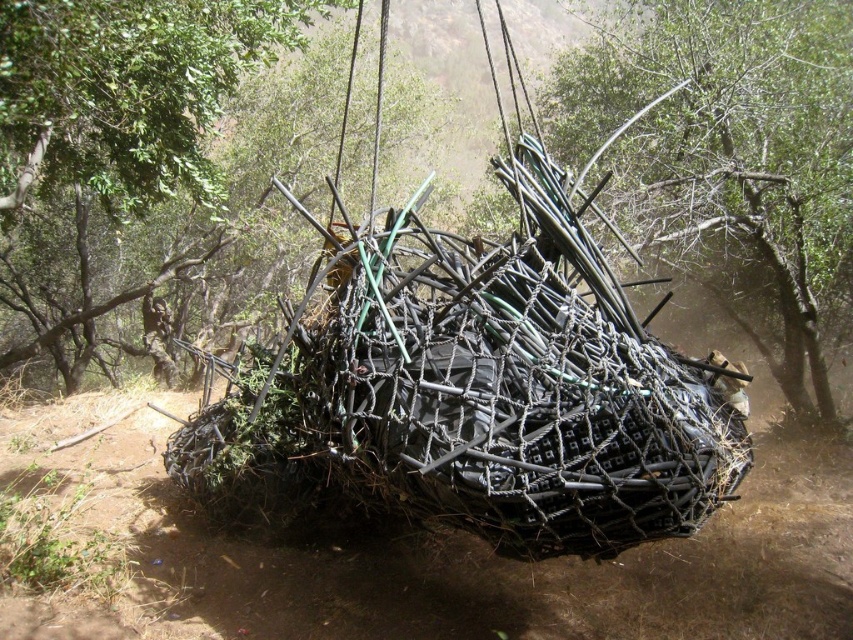
Can you confirm if green matte wire mesh at center is taller than green leafy tree at upper center?

Yes.

Is point (393, 118) farther from camera compared to point (100, 148)?

Yes.

Describe the element at coordinates (194, 192) in the screenshot. This screenshot has height=640, width=853. I see `green matte wire mesh at center` at that location.

This screenshot has width=853, height=640. I want to click on green matte wire mesh at center, so click(194, 192).

Who is positioned more to the right, brown dirt track at center or green matte wire mesh at center?

brown dirt track at center is more to the right.

Does brown dirt track at center have a lesser width compared to green matte wire mesh at center?

Correct, brown dirt track at center's width is less than green matte wire mesh at center's.

The width and height of the screenshot is (853, 640). Identify the location of brown dirt track at center. (436, 560).

Can you confirm if green matte wire mesh at center is shorter than green matte bamboo at center?

No, green matte wire mesh at center is not shorter than green matte bamboo at center.

Does green matte wire mesh at center have a lesser width compared to green matte bamboo at center?

No, green matte wire mesh at center is not thinner than green matte bamboo at center.

What do you see at coordinates (194, 192) in the screenshot? I see `green matte wire mesh at center` at bounding box center [194, 192].

The width and height of the screenshot is (853, 640). Find the location of `green matte wire mesh at center`. green matte wire mesh at center is located at coordinates (194, 192).